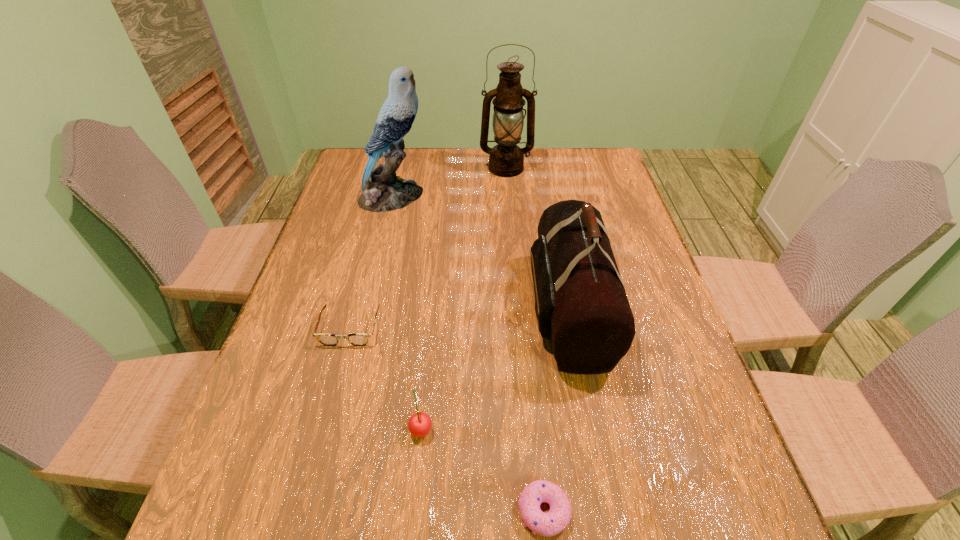
Identify the location of empty location between the nearest object and the parakeet. This screenshot has width=960, height=540. point(468,354).

Image resolution: width=960 pixels, height=540 pixels. Identify the location of vacant area between the duffel bag and the fifth nearest object. (481, 253).

The width and height of the screenshot is (960, 540). Identify the location of unoccupied position between the spectacles and the third tallest object. pos(459,319).

This screenshot has height=540, width=960. Identify the location of free point between the spectacles and the duffel bag. (459, 319).

The image size is (960, 540). Find the location of `free space between the nearest object and the parakeet`. free space between the nearest object and the parakeet is located at coordinates (468, 354).

In order to click on free point between the cherry and the second farthest object in this screenshot , I will do `click(407, 312)`.

Locate an element on the screen. vacant space in between the second farthest object and the oil lamp is located at coordinates (449, 183).

The width and height of the screenshot is (960, 540). I want to click on the third closest object to the spectacles, so click(x=382, y=191).

Where is `object that is the closest to the parakeet`? object that is the closest to the parakeet is located at coordinates coord(506,159).

This screenshot has width=960, height=540. Identify the location of vacant region that satisfies the following two spatial constraints: 1. on the front pocket of the duffel bag; 2. on the front side of the fifth farthest object. (590, 428).